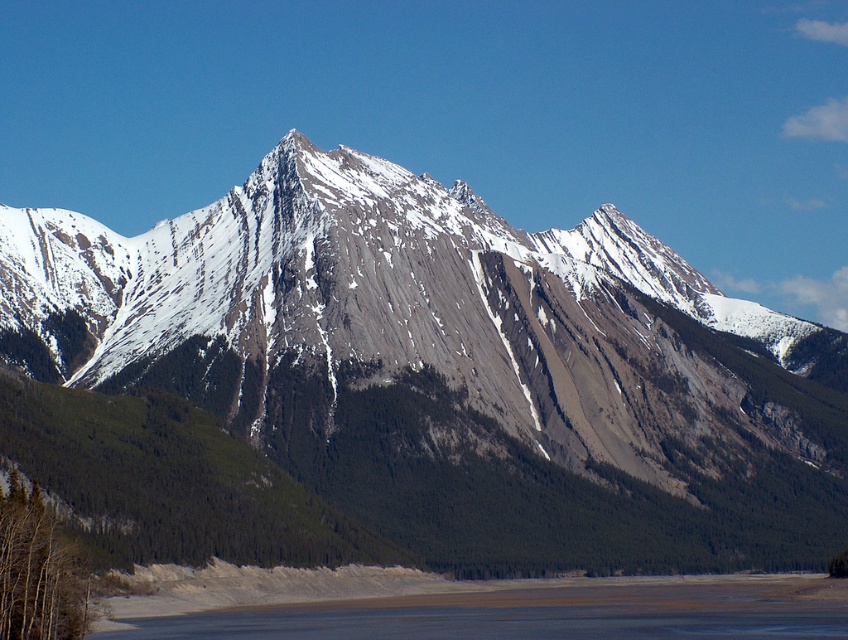
You are standing at the point marked as point (x=416, y=385) in the image. What is the closest object to you in the scene?

The gray rocky mountain at center is located at point (x=416, y=385), so the closest object to you is the gray rocky mountain at center.

Consider the image. You are planning to build a small cabin. You have two options for the location based on the image provided. The first option is near the gray rocky mountain at center, and the second is near the brown sand at lower center. Considering the spatial relationship between these two landmarks, which location would provide more stable ground for the foundation of your cabin?

The gray rocky mountain at center might be wider than brown sand at lower center, so building near the gray rocky mountain at center could provide more stable ground since wider areas often have more solid foundations compared to narrower ones.

You are standing at the base of the mountain and looking towards the peaks. You notice two points marked on the image. The first point is at coordinates point (389, 387), and the second is at point (683, 600). Which of these points is closer to you?

Point (389, 387) is in front of point (683, 600), so it is closer to you.